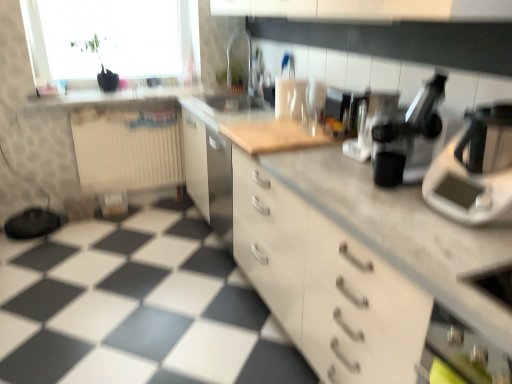
Question: Does beige ribbed radiator at left have a lesser height compared to transparent glass sink at center?

Choices:
 (A) no
 (B) yes

Answer: (A)

Question: From a real-world perspective, is beige ribbed radiator at left beneath transparent glass sink at center?

Choices:
 (A) yes
 (B) no

Answer: (A)

Question: Is beige ribbed radiator at left positioned before transparent glass sink at center?

Choices:
 (A) yes
 (B) no

Answer: (B)

Question: Is beige ribbed radiator at left beside transparent glass sink at center?

Choices:
 (A) yes
 (B) no

Answer: (B)

Question: Does beige ribbed radiator at left have a greater height compared to transparent glass sink at center?

Choices:
 (A) yes
 (B) no

Answer: (A)

Question: Considering the relative positions of white matte cabinet at center and black plastic coffee machine at center, arranged as the 2th coffee machine when viewed from the front, in the image provided, is white matte cabinet at center to the left or to the right of black plastic coffee machine at center, arranged as the 2th coffee machine when viewed from the front,?

Choices:
 (A) right
 (B) left

Answer: (B)

Question: From the image's perspective, is white matte cabinet at center positioned above or below black plastic coffee machine at center, arranged as the 2th coffee machine when viewed from the front?

Choices:
 (A) above
 (B) below

Answer: (B)

Question: From a real-world perspective, is white matte cabinet at center positioned above or below black plastic coffee machine at center, placed as the second coffee machine when sorted from back to front?

Choices:
 (A) below
 (B) above

Answer: (A)

Question: Choose the correct answer: Is white matte cabinet at center inside black plastic coffee machine at center, arranged as the 2th coffee machine when viewed from the front, or outside it?

Choices:
 (A) inside
 (B) outside

Answer: (B)

Question: Is black plastic coffee machine at center, arranged as the 2th coffee machine when viewed from the front, wider or thinner than beige ribbed radiator at left?

Choices:
 (A) wide
 (B) thin

Answer: (A)

Question: From the image's perspective, is black plastic coffee machine at center, placed as the second coffee machine when sorted from back to front, located above or below beige ribbed radiator at left?

Choices:
 (A) above
 (B) below

Answer: (A)

Question: From their relative heights in the image, would you say black plastic coffee machine at center, placed as the second coffee machine when sorted from back to front, is taller or shorter than beige ribbed radiator at left?

Choices:
 (A) short
 (B) tall

Answer: (A)

Question: In the image, is black plastic coffee machine at center, placed as the second coffee machine when sorted from back to front, positioned in front of or behind beige ribbed radiator at left?

Choices:
 (A) behind
 (B) front

Answer: (B)

Question: From the image's perspective, is white matte cabinet at center positioned above or below beige ribbed radiator at left?

Choices:
 (A) above
 (B) below

Answer: (B)

Question: From a real-world perspective, is white matte cabinet at center above or below beige ribbed radiator at left?

Choices:
 (A) below
 (B) above

Answer: (B)